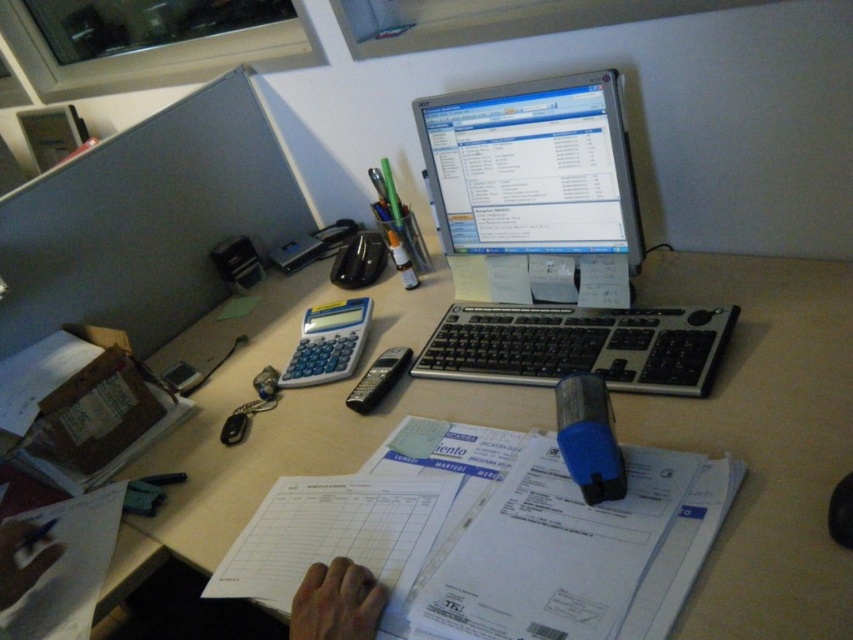
Between black plastic keyboard at center and skinny flesh at lower center, which one appears on the left side from the viewer's perspective?

skinny flesh at lower center

Consider the image. Does black plastic keyboard at center have a greater height compared to skinny flesh at lower center?

Indeed, black plastic keyboard at center has a greater height compared to skinny flesh at lower center.

Between point (451, 346) and point (364, 593), which one is positioned behind?

The point (451, 346) is behind.

You are a GUI agent. You are given a task and a screenshot of the screen. Output one action in this format:
    pyautogui.click(x=<x>, y=<y>)
    Task: Click on the black plastic keyboard at center
    The image size is (853, 640).
    Given the screenshot: What is the action you would take?
    (x=579, y=346)

From the picture: Does blue plastic calculator at center have a greater height compared to matte black hand at lower center?

Indeed, blue plastic calculator at center has a greater height compared to matte black hand at lower center.

Does point (363, 332) come behind point (7, 522)?

Yes, it is.

The height and width of the screenshot is (640, 853). What are the coordinates of `blue plastic calculator at center` in the screenshot? It's located at (328, 342).

Does black plastic keyboard at center appear on the left side of blue plastic calculator at center?

In fact, black plastic keyboard at center is to the right of blue plastic calculator at center.

Which is more to the right, black plastic keyboard at center or blue plastic calculator at center?

black plastic keyboard at center is more to the right.

Which is behind, point (601, 365) or point (323, 314)?

Positioned behind is point (323, 314).

This screenshot has height=640, width=853. I want to click on black plastic keyboard at center, so click(579, 346).